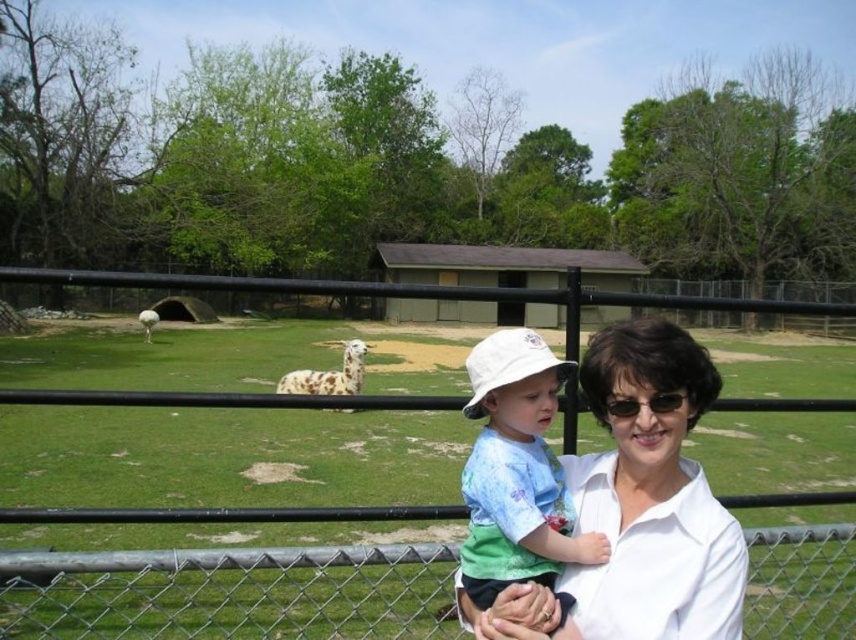
Which of these two, light blue cotton shirt at center or black plastic sunglasses at center, stands shorter?

black plastic sunglasses at center is shorter.

Which is behind, point (494, 506) or point (626, 396)?

The point (494, 506) is behind.

Where is `light blue cotton shirt at center`? This screenshot has height=640, width=856. light blue cotton shirt at center is located at coordinates (516, 472).

Can you confirm if black plastic sunglasses at center is positioned below white woolen sheep at left?

Indeed, black plastic sunglasses at center is positioned under white woolen sheep at left.

Looking at this image, who is positioned more to the left, black plastic sunglasses at center or white woolen sheep at left?

From the viewer's perspective, white woolen sheep at left appears more on the left side.

Measure the distance between point (x=652, y=403) and camera.

Result: A distance of 4.51 feet exists between point (x=652, y=403) and camera.

The width and height of the screenshot is (856, 640). Identify the location of black plastic sunglasses at center. (643, 403).

In the scene shown: Is spotted wool alpaca at center bigger than white woolen sheep at left?

Incorrect, spotted wool alpaca at center is not larger than white woolen sheep at left.

Who is higher up, spotted wool alpaca at center or white woolen sheep at left?

white woolen sheep at left

The width and height of the screenshot is (856, 640). Find the location of `spotted wool alpaca at center`. spotted wool alpaca at center is located at coordinates (330, 374).

You are a GUI agent. You are given a task and a screenshot of the screen. Output one action in this format:
    pyautogui.click(x=<x>, y=<y>)
    Task: Click on the spotted wool alpaca at center
    The height and width of the screenshot is (640, 856).
    Given the screenshot: What is the action you would take?
    pyautogui.click(x=330, y=374)